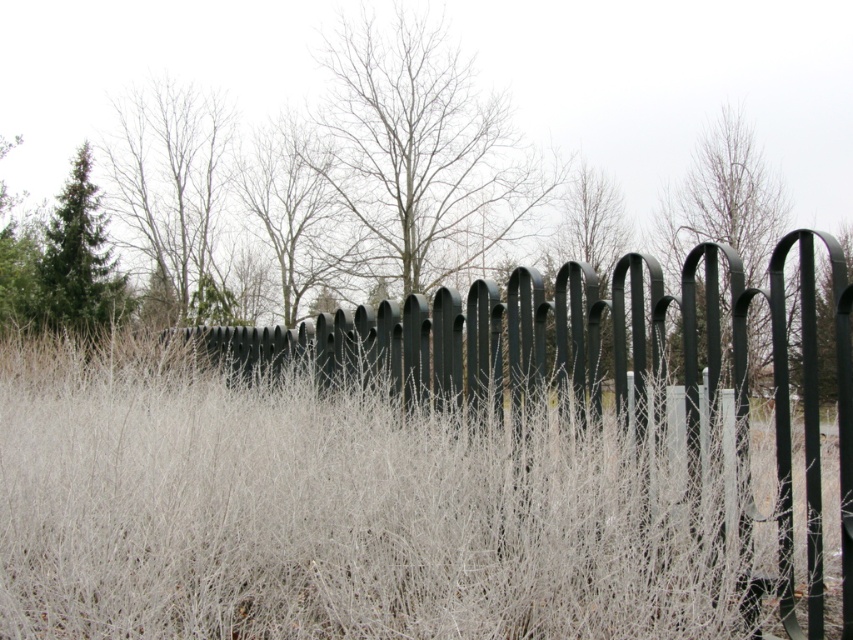
You are an artist planning to paint the scene. You need to decide which area to focus on first based on their sizes. Which object should you paint first, the white frosted grass at center or the green matte tree at upper right?

The white frosted grass at center is bigger than the green matte tree at upper right, so you should paint the white frosted grass at center first as it occupies a larger portion of the scene.

You are a landscape architect designing a path that must pass between the white frosted grass at center and the green matte tree at upper right. The path requires a minimum width of 15 meters to accommodate visitors comfortably. Based on the scene, will this path be feasible?

A: The distance between the white frosted grass at center and the green matte tree at upper right is 14.73 meters, which is slightly less than the required 15 meters. Therefore, the path may not be feasible as it falls short of the minimum width requirement.